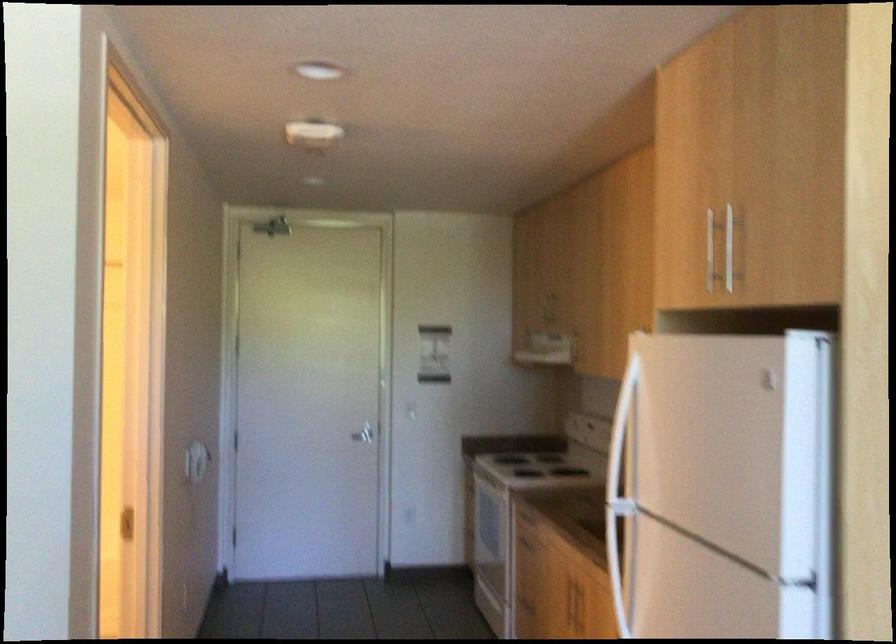
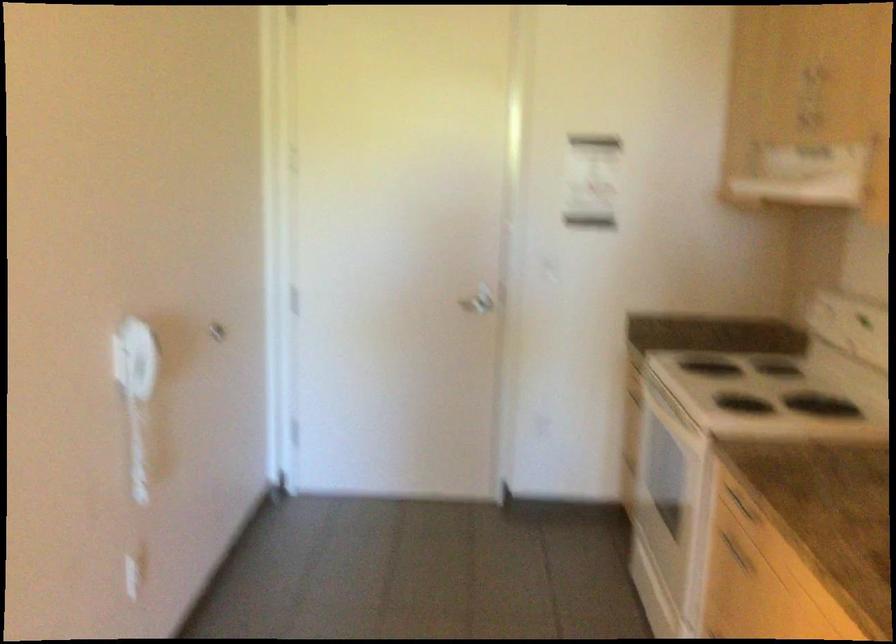
Question: The images are taken continuously from a first-person perspective. In which direction are you moving?

Choices:
 (A) Left
 (B) Right
 (C) Forward
 (D) Backward

Answer: (C)